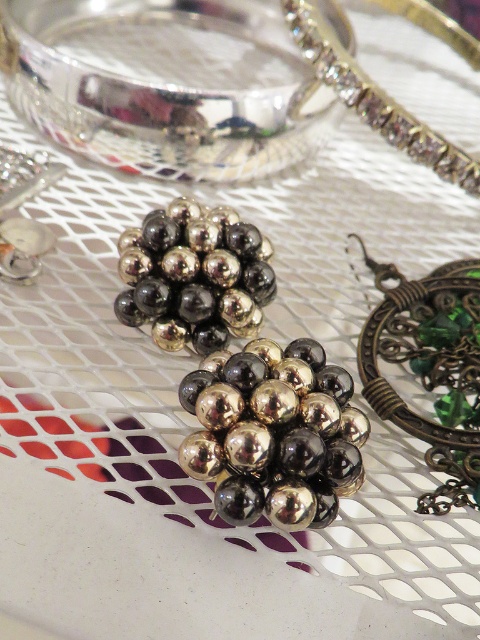
Question: Can you confirm if metallic gold/black beads at center is positioned to the left of shiny silver bracelet at upper right?

Choices:
 (A) no
 (B) yes

Answer: (B)

Question: Is metallic beads at center to the right of green glass pendant at upper right from the viewer's perspective?

Choices:
 (A) no
 (B) yes

Answer: (A)

Question: Estimate the real-world distances between objects in this image. Which object is farther from the metallic beads at center?

Choices:
 (A) shiny silver bracelet at upper right
 (B) metallic gold/black beads at center

Answer: (A)

Question: Is the position of metallic beads at center more distant than that of metallic gold/black beads at center?

Choices:
 (A) yes
 (B) no

Answer: (B)

Question: Among these objects, which one is farthest from the camera?

Choices:
 (A) metallic beads at center
 (B) green glass pendant at upper right
 (C) shiny silver bracelet at upper right

Answer: (C)

Question: Among these points, which one is farthest from the camera?

Choices:
 (A) (476, 429)
 (B) (384, 120)

Answer: (B)